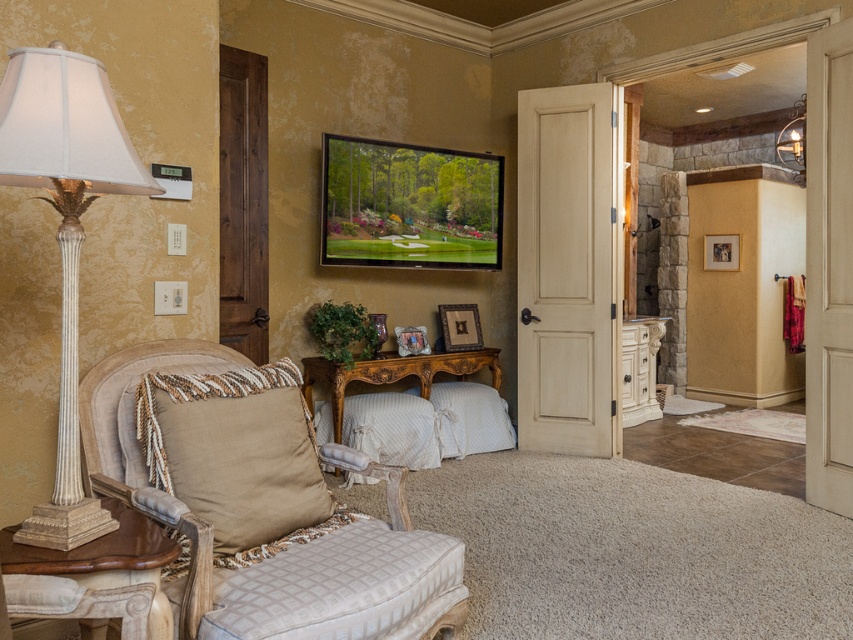
Which is more to the left, white textured lamp at left or wooden carved console table at center?

white textured lamp at left

Does white textured lamp at left have a greater width compared to wooden carved console table at center?

No.

Is point (67, 321) closer to camera compared to point (329, 381)?

Yes, it is.

This screenshot has width=853, height=640. Identify the location of white textured lamp at left. (65, 230).

Who is more forward, (x=233, y=433) or (x=329, y=365)?

Point (x=233, y=433) is more forward.

Is beige fabric pillow at lower left wider than wooden carved console table at center?

In fact, beige fabric pillow at lower left might be narrower than wooden carved console table at center.

Describe the element at coordinates (235, 452) in the screenshot. I see `beige fabric pillow at lower left` at that location.

Find the location of a particular element. The height and width of the screenshot is (640, 853). beige fabric pillow at lower left is located at coordinates (235, 452).

Which is above, beige fabric pillow at lower left or wooden table at left?

beige fabric pillow at lower left

Which is below, beige fabric pillow at lower left or wooden table at left?

wooden table at left

The image size is (853, 640). Describe the element at coordinates (235, 452) in the screenshot. I see `beige fabric pillow at lower left` at that location.

You are a GUI agent. You are given a task and a screenshot of the screen. Output one action in this format:
    pyautogui.click(x=<x>, y=<y>)
    Task: Click on the beige fabric pillow at lower left
    This screenshot has height=640, width=853.
    Given the screenshot: What is the action you would take?
    pyautogui.click(x=235, y=452)